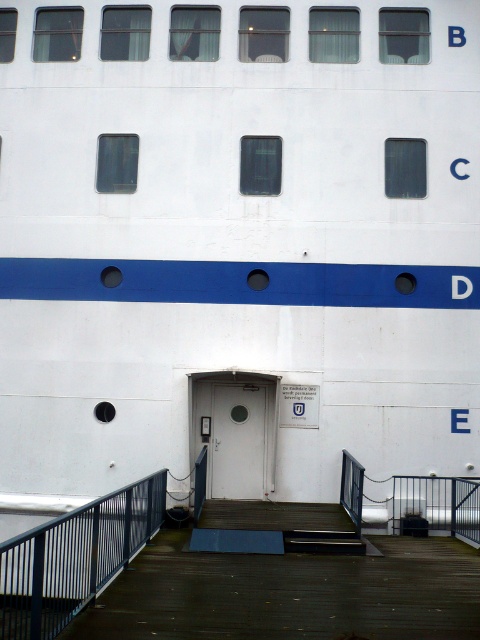
From the picture: What is the spatial relationship between the blue metal railing at lower left and the white matte door at center?

The blue metal railing at lower left is above the white matte door at center.

You are a passenger on the ship and need to enter the ship through the white matte door at center. There is a wooden deck stairs at center nearby. Considering their sizes, which one should you use to enter the ship?

You should use the white matte door at center to enter the ship since the wooden deck stairs at center is larger and likely meant for another purpose, such as accessing different decks.